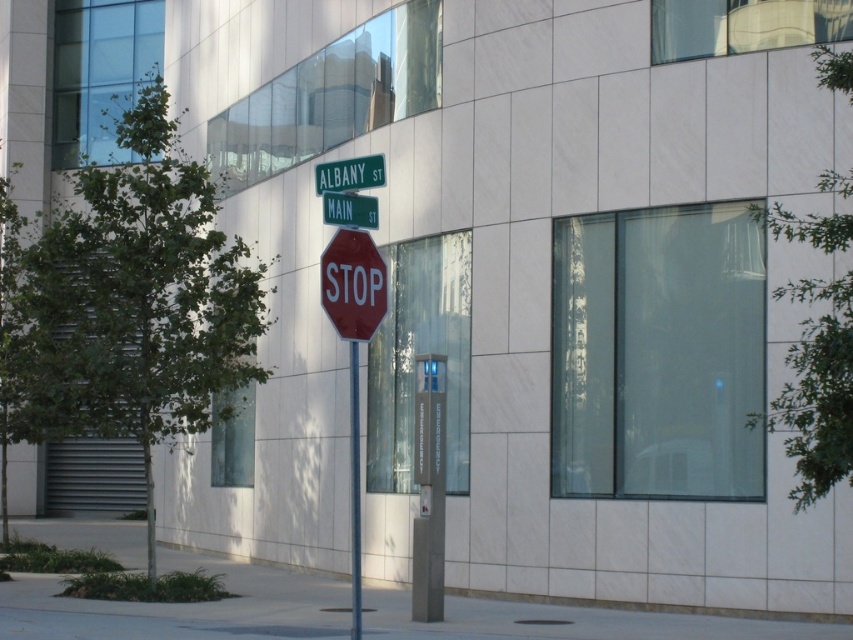
You are a pedestrian approaching the intersection. You see the red stop sign at center and the red matte stop sign at center. Which one is closer to you?

→ The red stop sign at center is closer to you because it is further to the viewer than the red matte stop sign at center.

You are a delivery driver approaching the intersection of Albany Street and Main Street. You see a point marked at coordinates (x=352, y=284). What object is located at that point?

The point at coordinates (x=352, y=284) indicates the red glossy stop sign at center.

You are a pedestrian at the intersection of Albany Street and Main Street. You see the red stop sign at center and the red matte stop sign at center. Which one is closer to you?

The red stop sign at center is positioned over the red matte stop sign at center, so the red stop sign at center is closer to you.